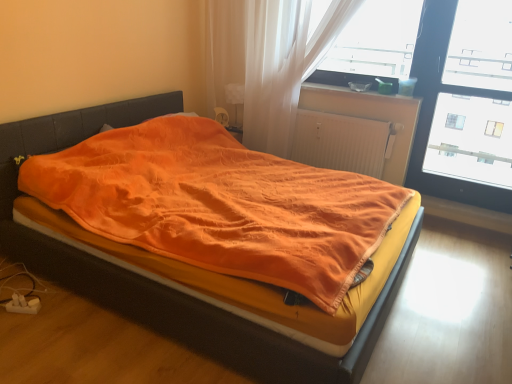
Question: Based on their positions, is transparent plastic window screen at upper right, which ranks as the 2th window screen in right-to-left order, located to the left or right of transparent glass window at upper right, the first window screen when ordered from right to left?

Choices:
 (A) left
 (B) right

Answer: (A)

Question: Considering the positions of point (382, 72) and point (452, 163), is point (382, 72) closer or farther from the camera than point (452, 163)?

Choices:
 (A) farther
 (B) closer

Answer: (B)

Question: Estimate the real-world distances between objects in this image. Which object is closer to the translucent fabric curtain at upper center?

Choices:
 (A) transparent glass window at upper right, the first window screen when ordered from right to left
 (B) transparent plastic window screen at upper right, which ranks as the 2th window screen in right-to-left order
 (C) white ribbed radiator at center
 (D) orange satin bed at center
 (E) matte plastic container at upper right

Answer: (C)

Question: Estimate the real-world distances between objects in this image. Which object is closer to the orange satin bed at center?

Choices:
 (A) transparent plastic window screen at upper right, which ranks as the 2th window screen in right-to-left order
 (B) transparent glass window at upper right, the first window screen when ordered from right to left
 (C) white ribbed radiator at center
 (D) translucent fabric curtain at upper center
 (E) matte plastic container at upper right

Answer: (D)